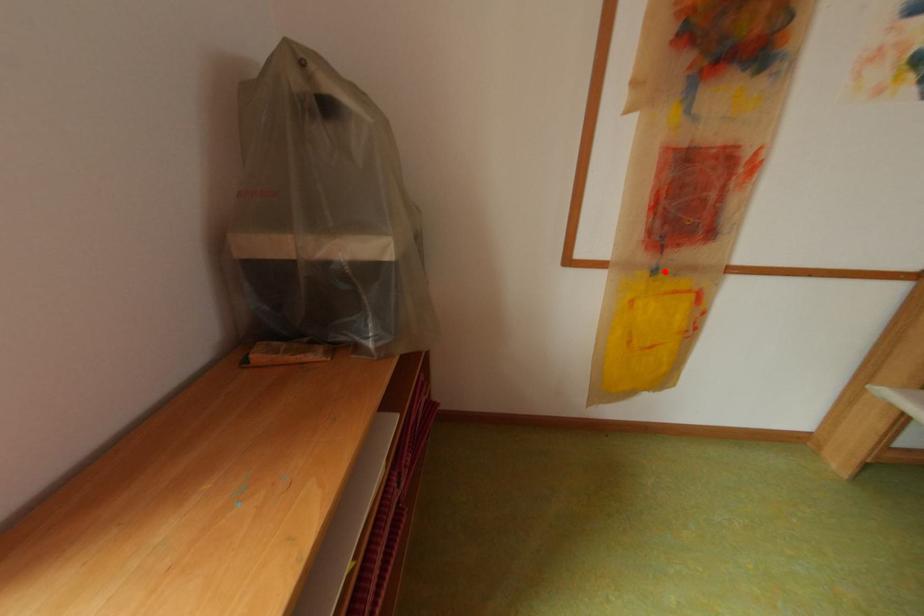
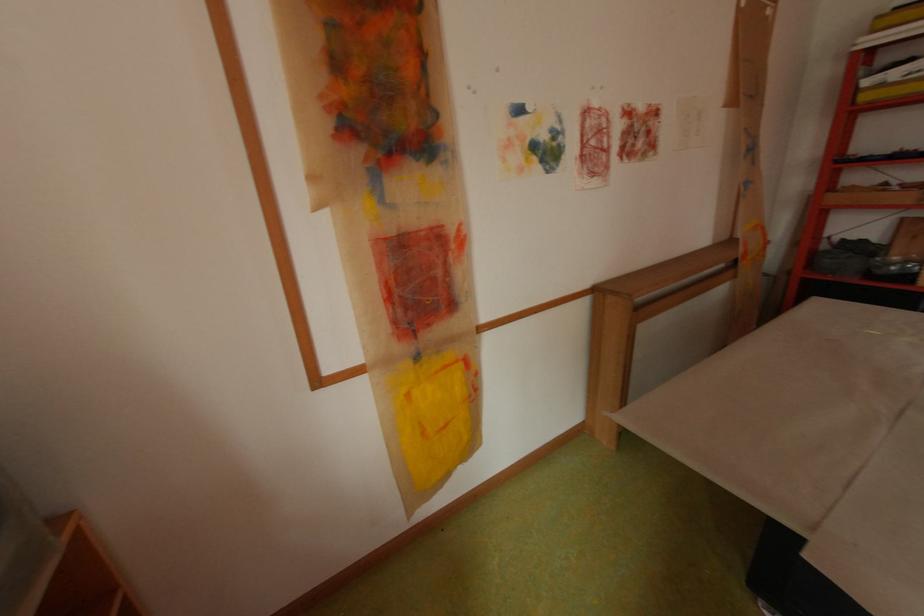
Find the pixel in the second image that matches the highlighted location in the first image.

(429, 358)